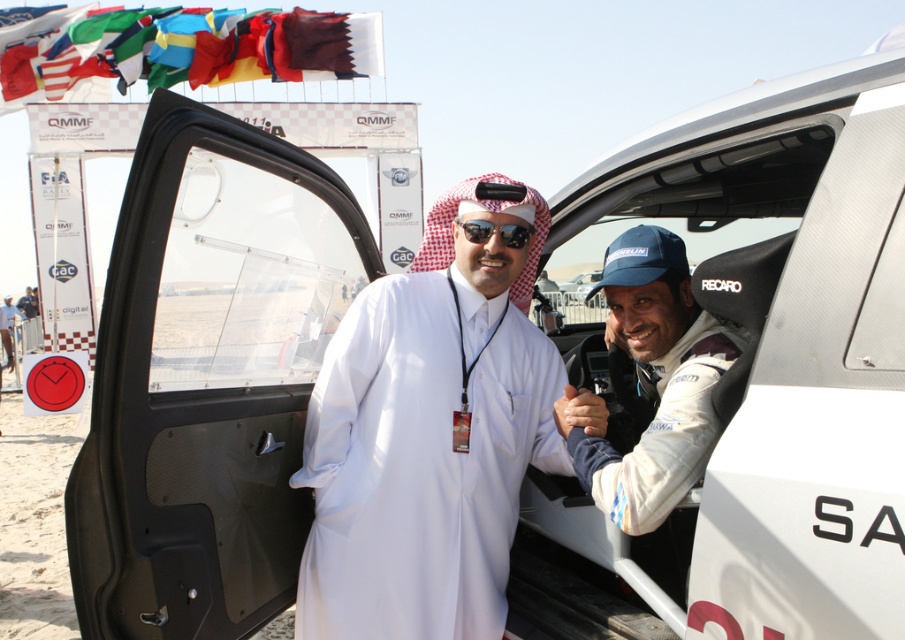
Question: Does white matte robe at center have a larger size compared to sunglasses at center?

Choices:
 (A) no
 (B) yes

Answer: (B)

Question: Is the position of white leather racing suit at center more distant than that of sunglasses at center?

Choices:
 (A) no
 (B) yes

Answer: (A)

Question: Which object is farther from the camera taking this photo?

Choices:
 (A) sunglasses at center
 (B) white matte robe at center

Answer: (A)

Question: Among these points, which one is farthest from the camera?

Choices:
 (A) (510, 243)
 (B) (517, 332)

Answer: (B)

Question: Is the position of white matte robe at center more distant than that of white leather racing suit at center?

Choices:
 (A) no
 (B) yes

Answer: (B)

Question: Which of the following is the closest to the observer?

Choices:
 (A) (x=332, y=388)
 (B) (x=505, y=234)
 (C) (x=642, y=438)

Answer: (C)